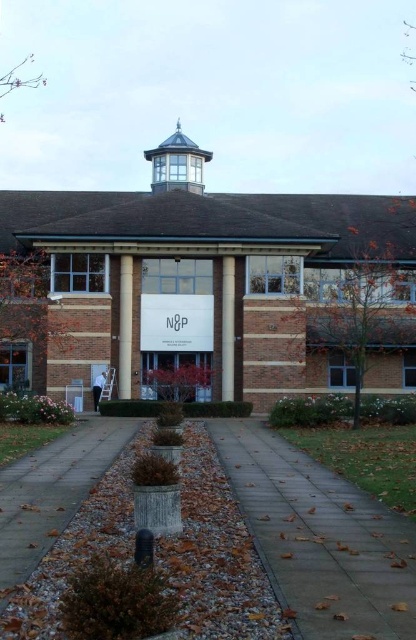
Question: Which point is closer to the camera taking this photo?

Choices:
 (A) (225, 317)
 (B) (119, 268)
 (C) (254, 534)

Answer: (C)

Question: Which point is closer to the camera?

Choices:
 (A) brown wood pillar at left
 (B) brown brick building at center
 (C) gray concrete pavement at lower center

Answer: (C)

Question: Based on their relative distances, which object is farther from the white concrete pillar at center?

Choices:
 (A) brown gravel at lower left
 (B) brown brick building at center

Answer: (A)

Question: Is the position of brown gravel at lower left less distant than that of brown wood pillar at left?

Choices:
 (A) no
 (B) yes

Answer: (B)

Question: Considering the relative positions of brown brick building at center and white concrete pillar at center in the image provided, where is brown brick building at center located with respect to white concrete pillar at center?

Choices:
 (A) above
 (B) below

Answer: (A)

Question: Can you confirm if brown brick building at center is positioned above white concrete pillar at center?

Choices:
 (A) no
 (B) yes

Answer: (B)